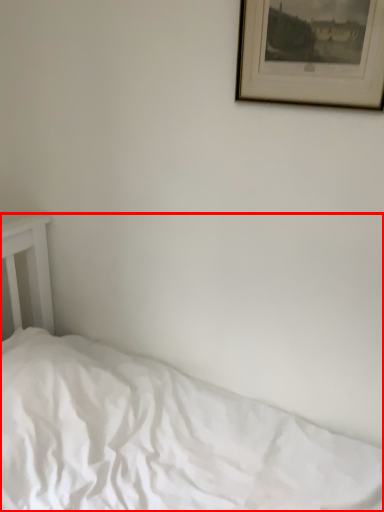
Question: From the image's perspective, where is bed (annotated by the red box) located relative to picture frame?

Choices:
 (A) above
 (B) below

Answer: (B)